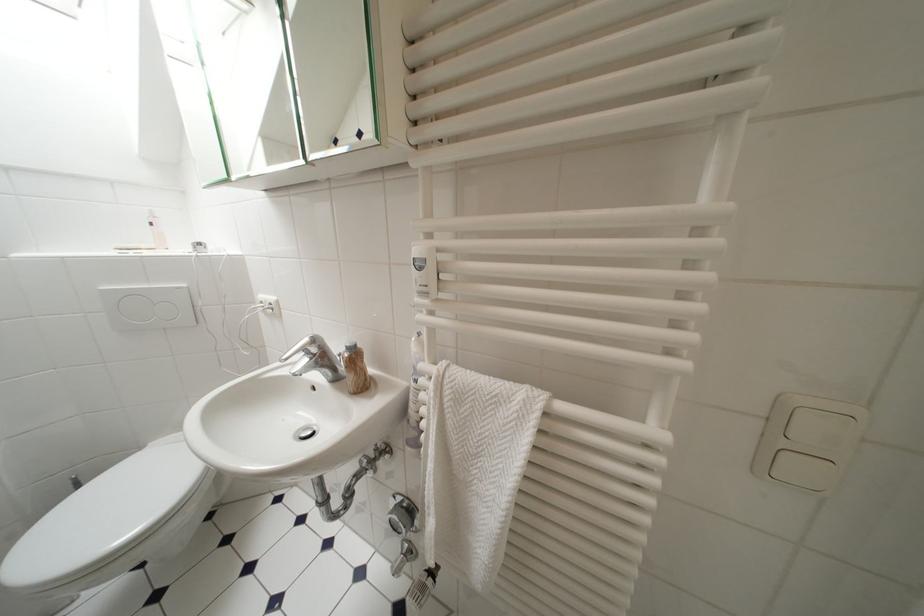
Which object does [473,467] point to?

It corresponds to the white patterned towel in the image.